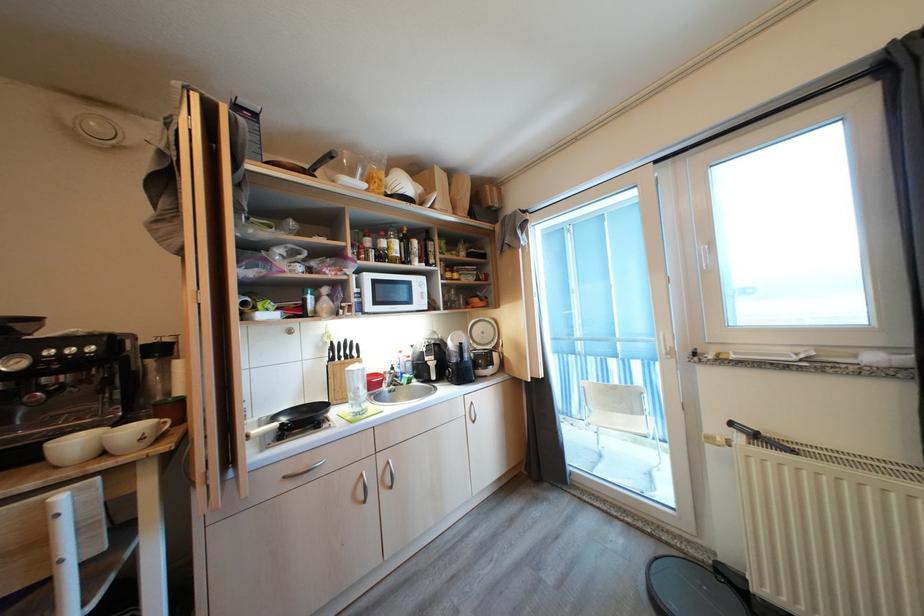
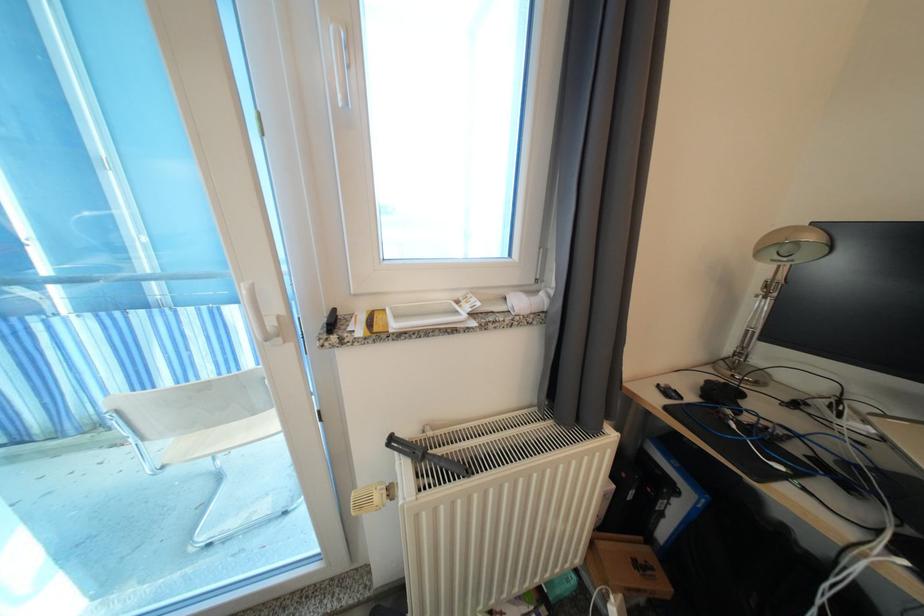
The point at (637,416) is marked in the first image. Where is the corresponding point in the second image?

(259, 416)